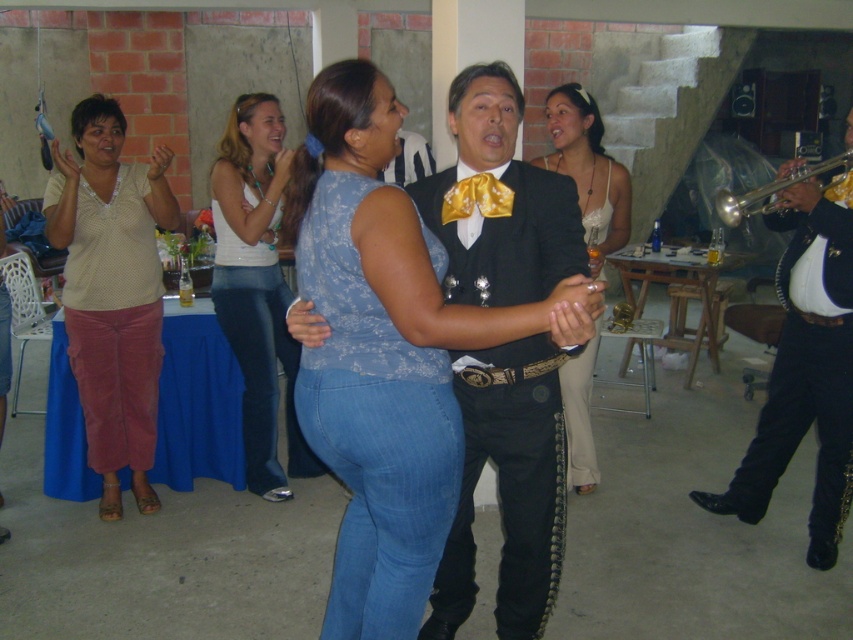
Does point (254, 451) lie behind point (583, 141)?

That is True.

This screenshot has height=640, width=853. I want to click on white denim jeans at center, so click(256, 285).

Between point (245, 192) and point (572, 141), which one is positioned in front?

Positioned in front is point (245, 192).

Locate an element on the screen. The width and height of the screenshot is (853, 640). white denim jeans at center is located at coordinates (256, 285).

Where is `shiny black pants at right`? shiny black pants at right is located at coordinates (805, 369).

Is shiny black pants at right positioned at the back of white lace dress at center?

No, it is in front of white lace dress at center.

Does point (753, 436) come in front of point (572, 96)?

That is False.

This screenshot has width=853, height=640. I want to click on shiny black pants at right, so click(805, 369).

Between point (125, 285) and point (718, 205), which one is positioned behind?

Positioned behind is point (125, 285).

Between matte beige blouse at left and gold metallic trumpet at right, which one has less height?

Standing shorter between the two is gold metallic trumpet at right.

Is point (122, 227) in front of point (740, 196)?

No.

Locate an element on the screen. The image size is (853, 640). matte beige blouse at left is located at coordinates click(x=112, y=291).